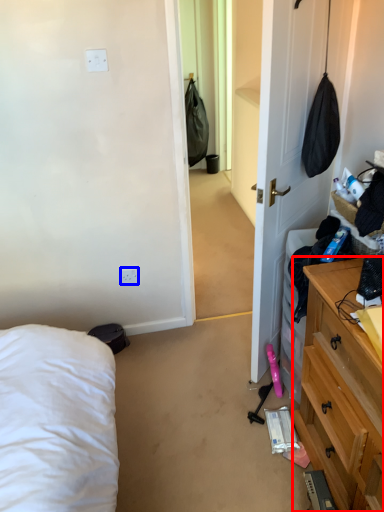
Question: Which point is further to the camera, cabinetry (highlighted by a red box) or electric outlet (highlighted by a blue box)?

Choices:
 (A) cabinetry
 (B) electric outlet

Answer: (B)